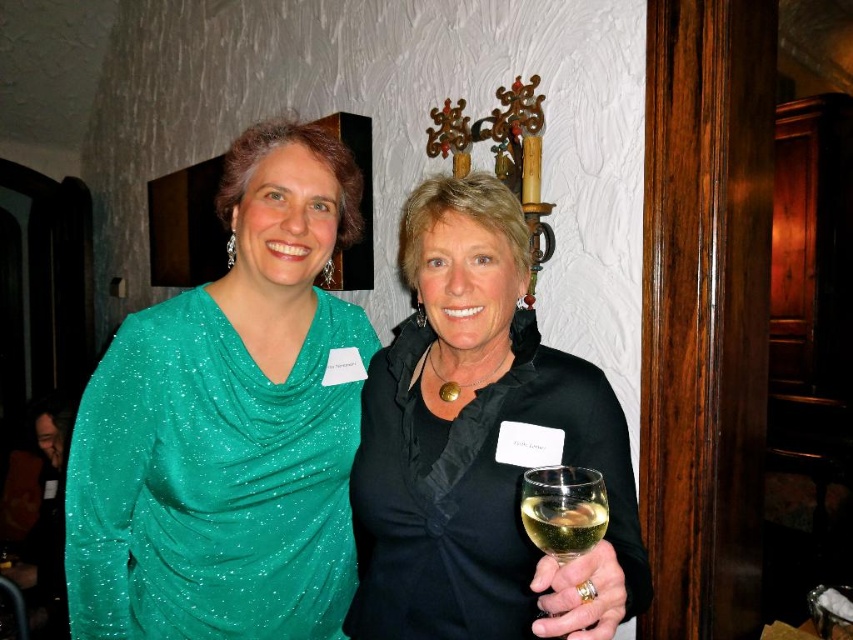
You are a photographer at a social event. You need to capture a photo of the green sparkly dress at center and the clear glass wine glass at center. Which object should you focus on first if you want to ensure both are in frame without moving the camera?

The green sparkly dress at center has a greater height compared to the clear glass wine glass at center, so focusing on the taller dress first will ensure both are in frame since the dress occupies more vertical space.

You are a photographer at a social event and need to adjust the camera focus. You notice the black satin blouse at center and the translucent glass at center. Which object should you focus on first if you want to capture the larger object in sharp detail?

The black satin blouse at center is larger in size than the translucent glass at center, so you should focus on the black satin blouse at center first to capture the larger object in sharp detail.

You are at a social event and need to locate the black satin blouse at center. According to the coordinates provided, where would you look to find it?

The black satin blouse at center is located at point (x=479, y=445).